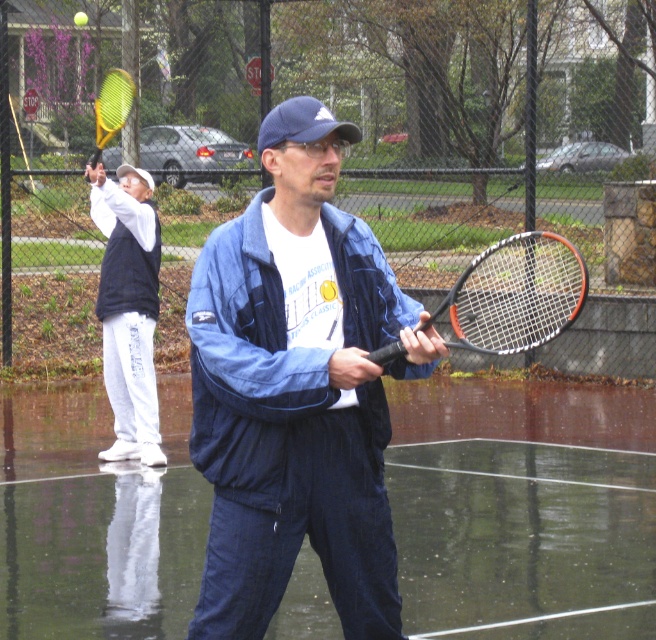
Question: Does blue fabric jacket at center appear on the right side of white fleece jacket at upper left?

Choices:
 (A) no
 (B) yes

Answer: (B)

Question: Which point is farther to the camera?

Choices:
 (A) (134, 305)
 (B) (298, 104)
 (C) (121, 97)

Answer: (C)

Question: Which point is closer to the camera taking this photo?

Choices:
 (A) (352, 460)
 (B) (552, 285)
 (C) (98, 120)
 (D) (335, 122)

Answer: (D)

Question: Can you confirm if blue fabric jacket at center is wider than black rubber tennis racket at center?

Choices:
 (A) no
 (B) yes

Answer: (B)

Question: Which point is closer to the camera?

Choices:
 (A) yellowmaterial tennis racket at left
 (B) white fleece jacket at upper left

Answer: (B)

Question: Is black rubber tennis racket at center bigger than yellowmaterial tennis racket at left?

Choices:
 (A) no
 (B) yes

Answer: (A)